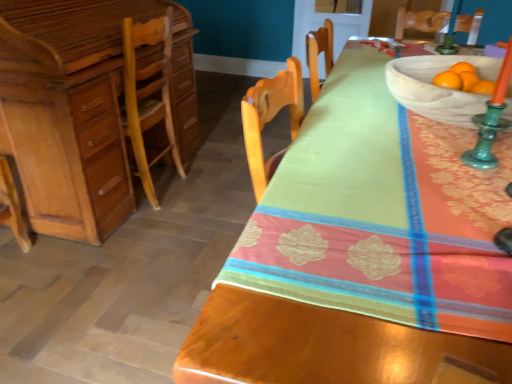
Question: Is matte wood desk at left facing towards light brown wood desk at left?

Choices:
 (A) yes
 (B) no

Answer: (B)

Question: From the image's perspective, is matte wood desk at left located beneath light brown wood desk at left?

Choices:
 (A) no
 (B) yes

Answer: (B)

Question: Does matte wood desk at left appear on the left side of light brown wood desk at left?

Choices:
 (A) yes
 (B) no

Answer: (B)

Question: Is matte wood desk at left far away from light brown wood desk at left?

Choices:
 (A) yes
 (B) no

Answer: (A)

Question: Is matte wood desk at left outside light brown wood desk at left?

Choices:
 (A) no
 (B) yes

Answer: (B)

Question: Does matte wood desk at left come in front of light brown wood desk at left?

Choices:
 (A) yes
 (B) no

Answer: (A)

Question: Considering the relative sizes of matte wood desk at left and natural wood bowl at upper right in the image provided, is matte wood desk at left thinner than natural wood bowl at upper right?

Choices:
 (A) yes
 (B) no

Answer: (B)

Question: Considering the relative sizes of matte wood desk at left and natural wood bowl at upper right in the image provided, is matte wood desk at left smaller than natural wood bowl at upper right?

Choices:
 (A) no
 (B) yes

Answer: (A)

Question: Considering the relative sizes of matte wood desk at left and natural wood bowl at upper right in the image provided, is matte wood desk at left taller than natural wood bowl at upper right?

Choices:
 (A) no
 (B) yes

Answer: (B)

Question: Is matte wood desk at left behind natural wood bowl at upper right?

Choices:
 (A) no
 (B) yes

Answer: (A)

Question: Is matte wood desk at left with natural wood bowl at upper right?

Choices:
 (A) yes
 (B) no

Answer: (B)

Question: Could you tell me if matte wood desk at left is facing natural wood bowl at upper right?

Choices:
 (A) no
 (B) yes

Answer: (A)

Question: From the image's perspective, is light brown wood desk at left under natural wood bowl at upper right?

Choices:
 (A) no
 (B) yes

Answer: (A)